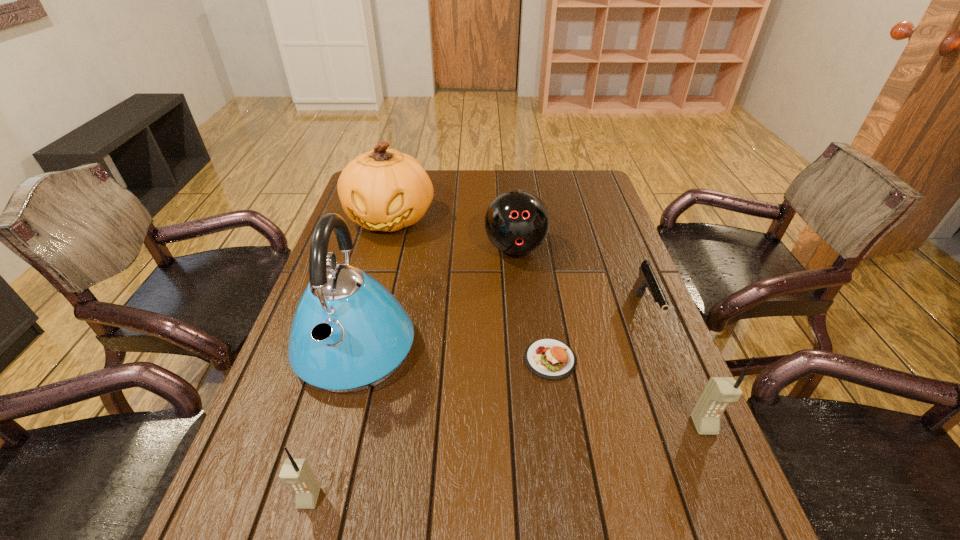
Please point a space for a new cellular_telephone to maintain equal intervals. Please provide its 2D coordinates. Your answer should be formatted as a tuple, i.e. [(x, y)], where the tuple contains the x and y coordinates of a point satisfying the conditions above.

[(519, 460)]